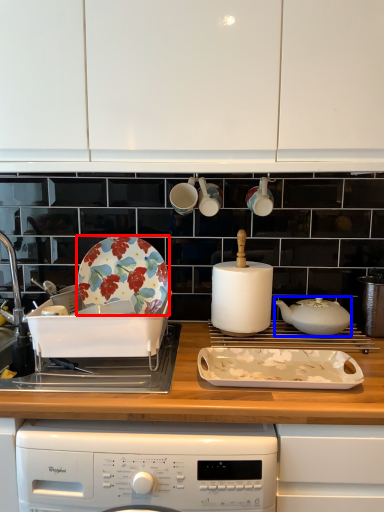
Question: Which object appears closest to the camera in this image, plate (highlighted by a red box) or kitchen appliance (highlighted by a blue box)?

Choices:
 (A) plate
 (B) kitchen appliance

Answer: (B)